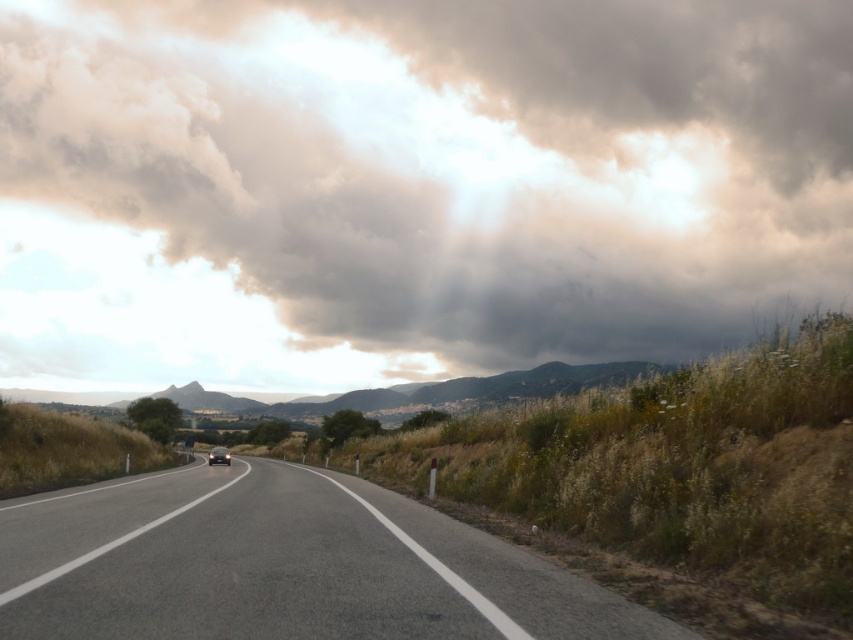
Question: Is gray fluffy cloud at upper center wider than shiny black car at center?

Choices:
 (A) no
 (B) yes

Answer: (B)

Question: Which is farther from the gray fluffy cloud at upper center?

Choices:
 (A) asphalt road at center
 (B) shiny black car at center

Answer: (A)

Question: Does gray fluffy cloud at upper center have a greater width compared to asphalt road at center?

Choices:
 (A) no
 (B) yes

Answer: (B)

Question: Can you confirm if gray fluffy cloud at upper center is positioned to the left of shiny black car at center?

Choices:
 (A) no
 (B) yes

Answer: (A)

Question: Which is farther from the shiny black car at center?

Choices:
 (A) gray fluffy cloud at upper center
 (B) asphalt road at center

Answer: (A)

Question: Which point is closer to the camera?

Choices:
 (A) (334, 109)
 (B) (437, 628)
 (C) (227, 449)

Answer: (B)